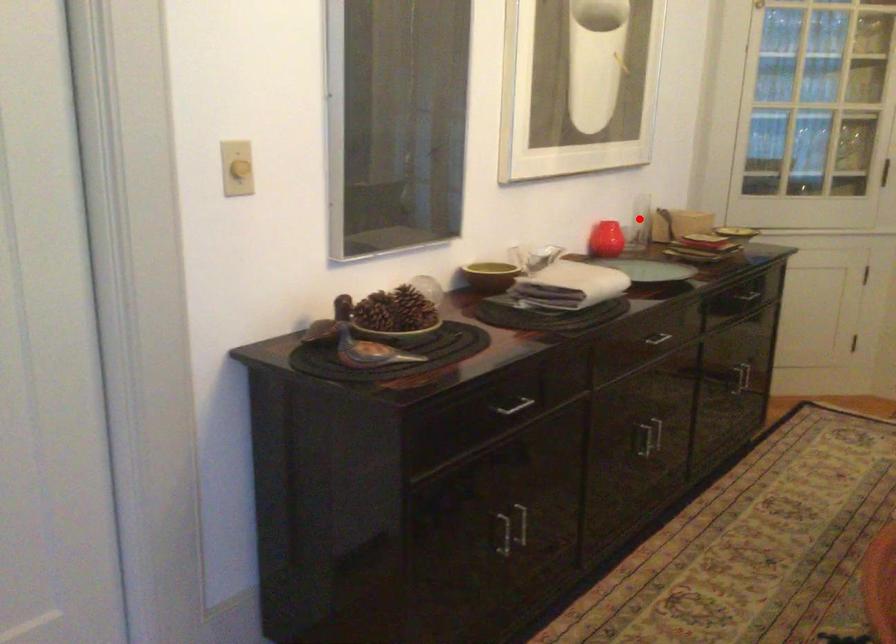
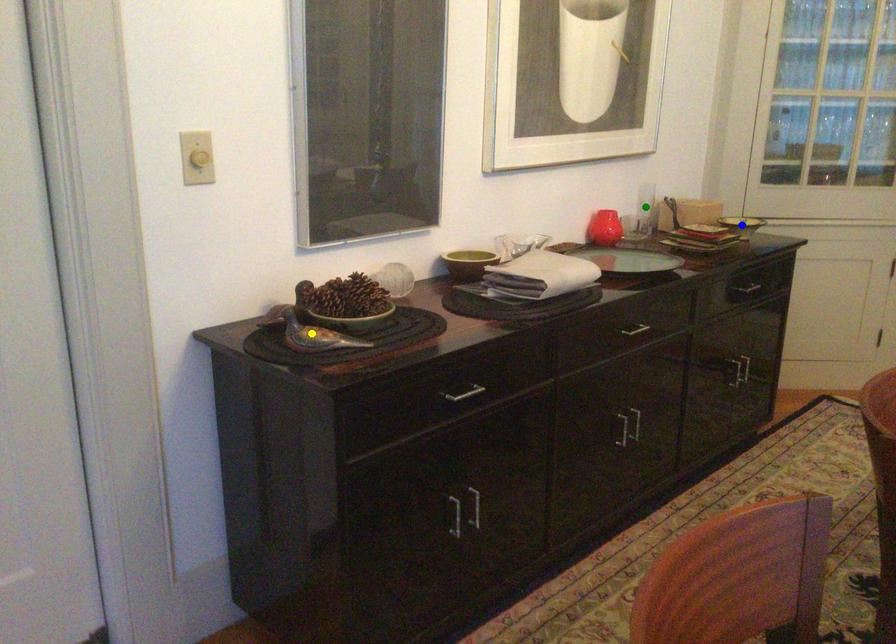
Question: I am providing you with two images of the same scene from different viewpoints. A red point is marked on the first image. You are given multiple points on the second image. Which point in image 2 represents the same 3d spot as the red point in image 1?

Choices:
 (A) blue point
 (B) green point
 (C) yellow point

Answer: (B)